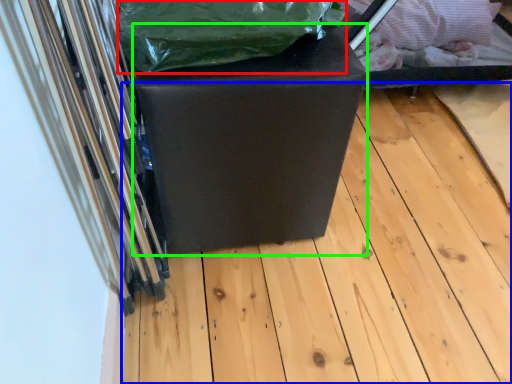
Question: Considering the real-world distances, which object is closest to waste (highlighted by a red box)? wood (highlighted by a blue box) or furniture (highlighted by a green box).

Choices:
 (A) wood
 (B) furniture

Answer: (B)